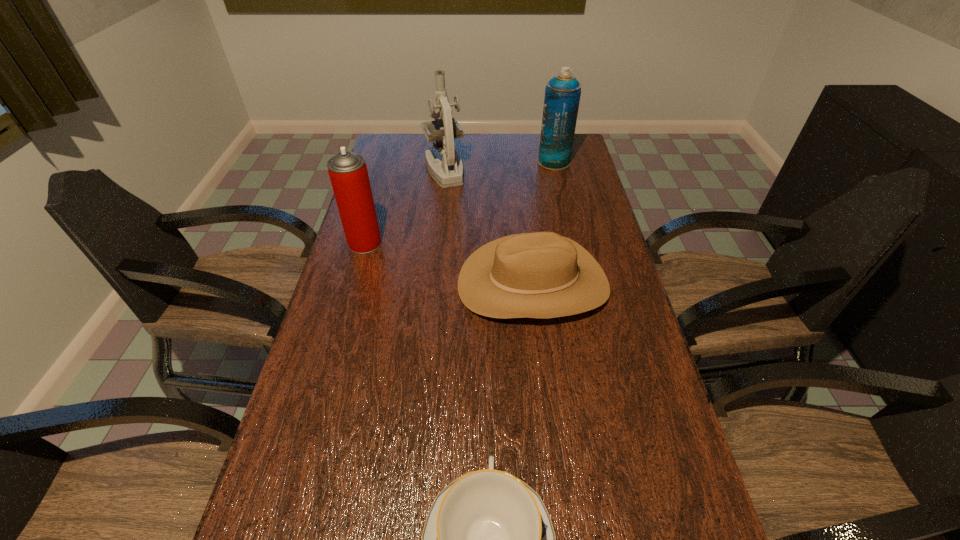
Where is `microscope`? microscope is located at coordinates (449, 172).

Where is `the right aerosol can`? The width and height of the screenshot is (960, 540). the right aerosol can is located at coordinates (562, 93).

Find the location of a particular element. This screenshot has height=540, width=960. the nearer aerosol can is located at coordinates (348, 173).

Locate an element on the screen. The width and height of the screenshot is (960, 540). the leftmost object is located at coordinates (348, 173).

Locate an element on the screen. Image resolution: width=960 pixels, height=540 pixels. the second shortest object is located at coordinates click(x=537, y=275).

You are a GUI agent. You are given a task and a screenshot of the screen. Output one action in this format:
    pyautogui.click(x=<x>, y=<y>)
    Task: Click on the vacant space located on the front of the microscope
    
    Given the screenshot: What is the action you would take?
    pyautogui.click(x=436, y=247)

Identify the location of vacant space located 0.260m on the front of the right aerosol can. The height and width of the screenshot is (540, 960). (565, 212).

The width and height of the screenshot is (960, 540). Find the location of `vacant space situated on the right of the leftmost object`. vacant space situated on the right of the leftmost object is located at coordinates (430, 243).

This screenshot has width=960, height=540. In order to click on free region located 0.110m on the left of the cowboy hat in this screenshot , I will do `click(420, 284)`.

This screenshot has height=540, width=960. In order to click on microscope situated at the far edge in this screenshot , I will do `click(449, 172)`.